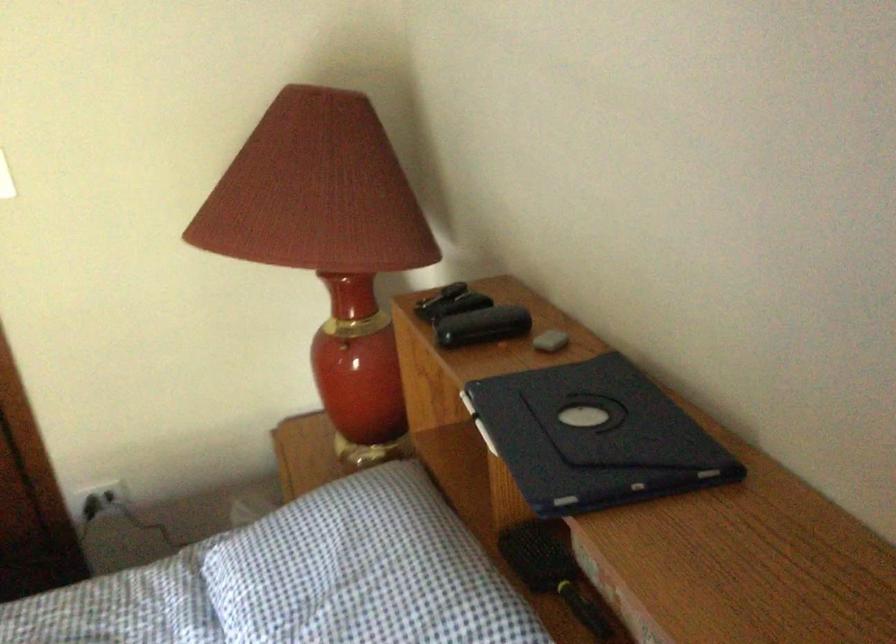
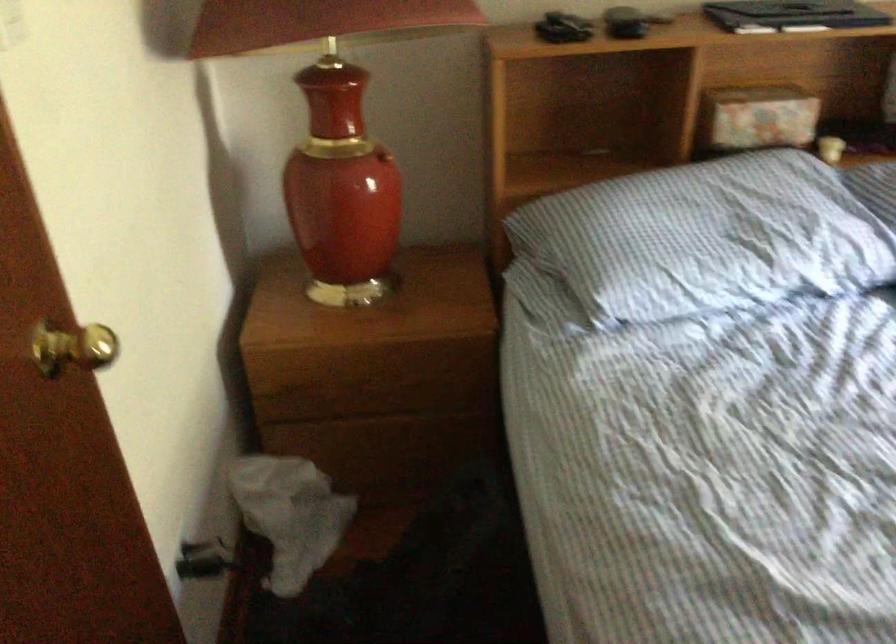
Where in the second image is the point corresponding to the point at 150,509 from the first image?

(204, 560)